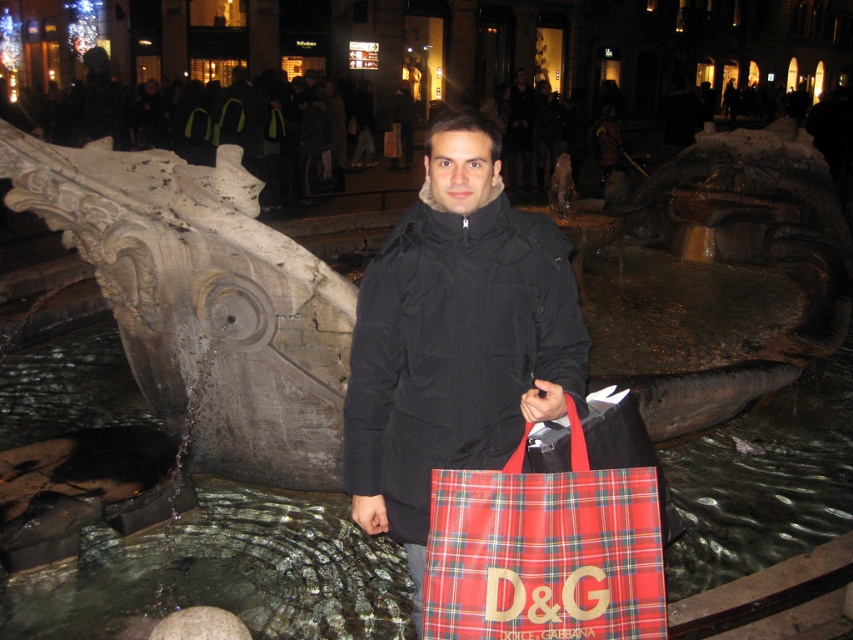
You are a fashion designer observing the scene. You notice the black matte coat at center and the red plaid fabric shopping bag at center. Which item is positioned higher relative to the other?

The black matte coat at center is located above the red plaid fabric shopping bag at center, so it is positioned higher.

You are a photographer positioned in the public square. You want to take a photo of the black matte coat at center and the red plaid fabric shopping bag at center. Which object should you focus on first to ensure both are in sharp focus?

You should focus on the black matte coat at center first since it is closer to you than the red plaid fabric shopping bag at center, ensuring both will be in focus when using a shallow depth of field.